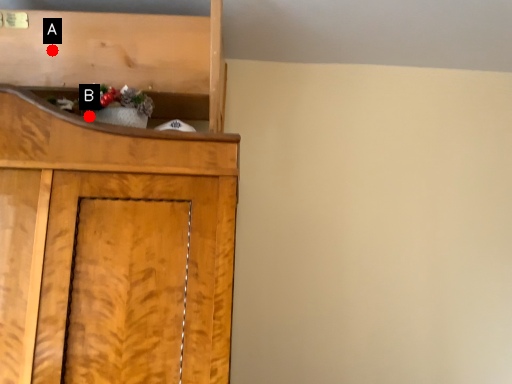
Question: Two points are circled on the image, labeled by A and B beside each circle. Among these points, which one is nearest to the camera?

Choices:
 (A) A is closer
 (B) B is closer

Answer: (B)